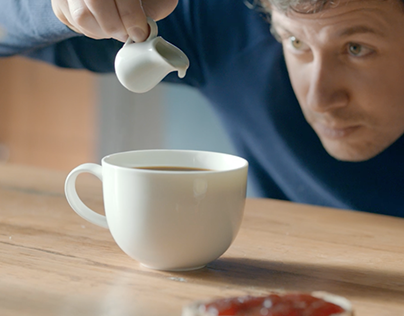
Identify the location of faint reflection of teacup on table surface. point(126,296).